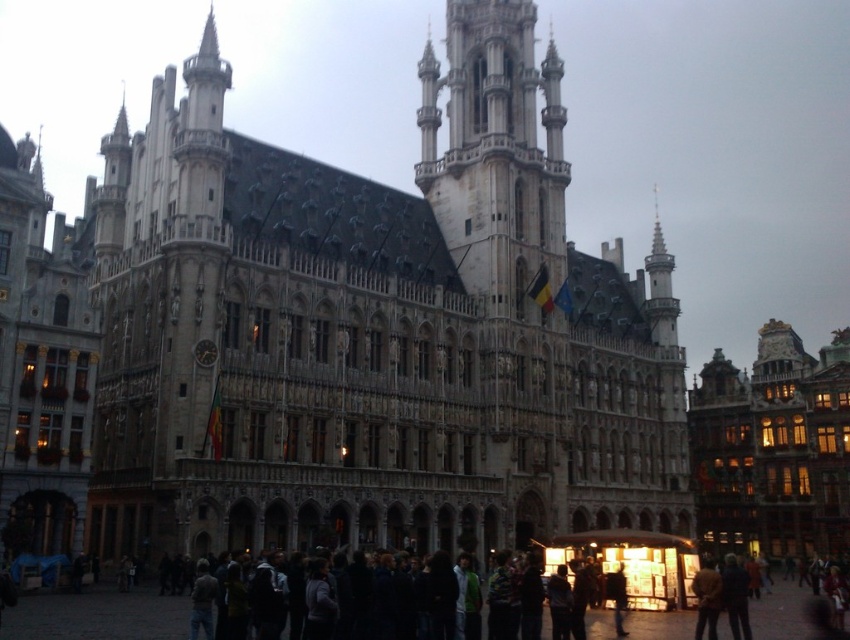
Can you confirm if stone building at center is taller than stone tower at center?

Yes, stone building at center is taller than stone tower at center.

Is stone building at center bigger than stone tower at center?

Yes.

Locate an element on the screen. The image size is (850, 640). stone building at center is located at coordinates (374, 330).

This screenshot has height=640, width=850. In order to click on stone building at center in this screenshot , I will do `click(374, 330)`.